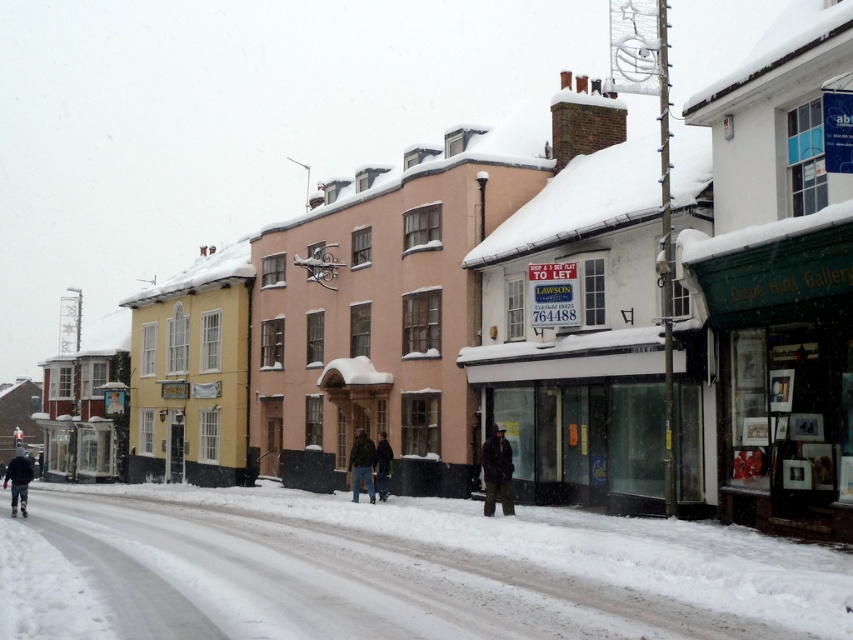
Question: Which of the following is the farthest from the observer?

Choices:
 (A) click(x=26, y=470)
 (B) click(x=390, y=456)
 (C) click(x=263, y=577)
 (D) click(x=831, y=221)

Answer: (B)

Question: In this image, where is white powdery snow at lower center located relative to green matte signboard at center?

Choices:
 (A) below
 (B) above

Answer: (A)

Question: Which point is closer to the camera?

Choices:
 (A) (489, 500)
 (B) (30, 480)
 (C) (357, 500)

Answer: (A)

Question: Does white powdery snow at lower center appear on the right side of green fuzzy jacket at center?

Choices:
 (A) yes
 (B) no

Answer: (B)

Question: Estimate the real-world distances between objects in this image. Which object is farther from the green fuzzy jacket at center?

Choices:
 (A) dark gray jacket at lower left
 (B) green matte signboard at center

Answer: (B)

Question: Observing the image, what is the correct spatial positioning of white powdery snow at lower center in reference to green matte signboard at center?

Choices:
 (A) above
 (B) below

Answer: (B)